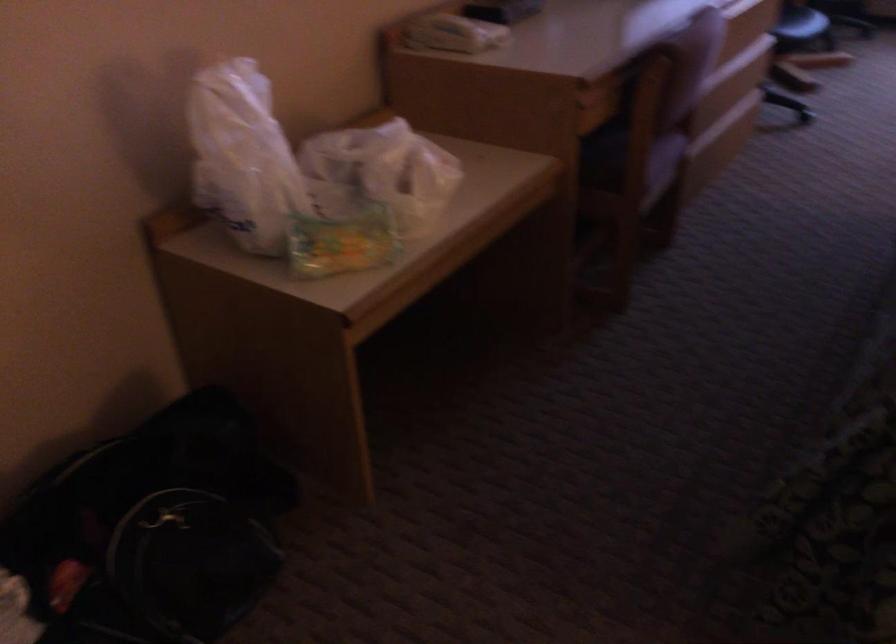
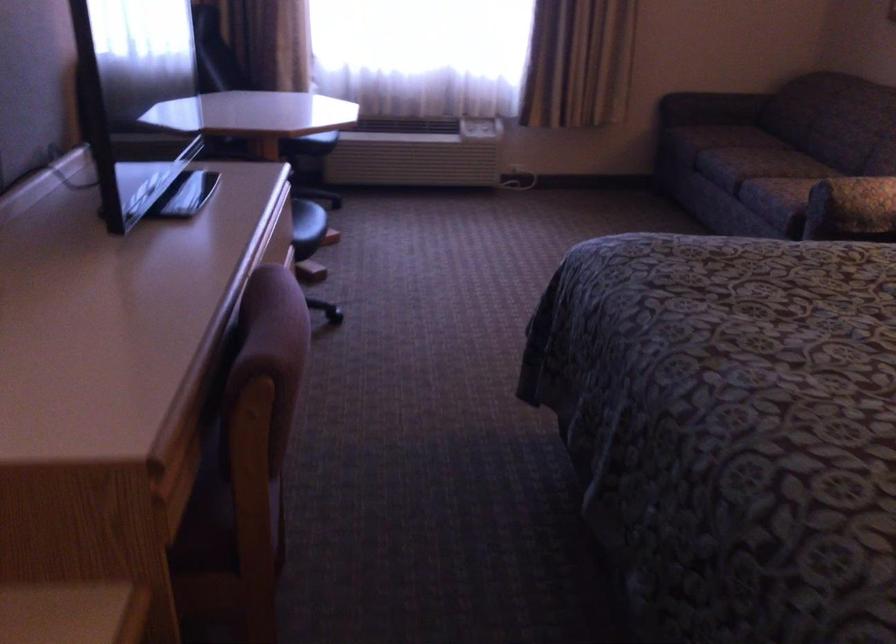
Question: How did the camera likely rotate?

Choices:
 (A) Left
 (B) Right
 (C) Up
 (D) Down

Answer: (B)